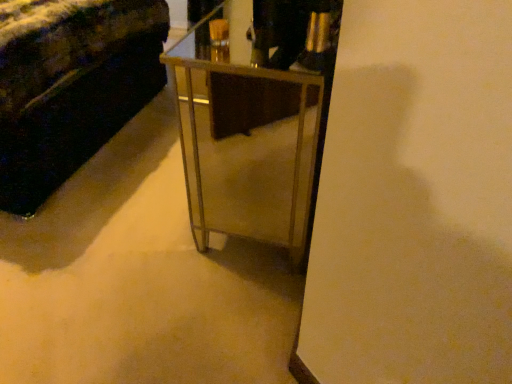
The width and height of the screenshot is (512, 384). Find the location of `vacant region to the left of metallic gold table at center`. vacant region to the left of metallic gold table at center is located at coordinates (126, 205).